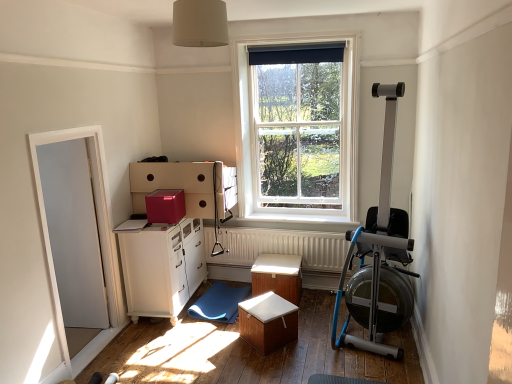
Where is `empty space that is ontop of white glossy door at left`? The image size is (512, 384). empty space that is ontop of white glossy door at left is located at coordinates (61, 125).